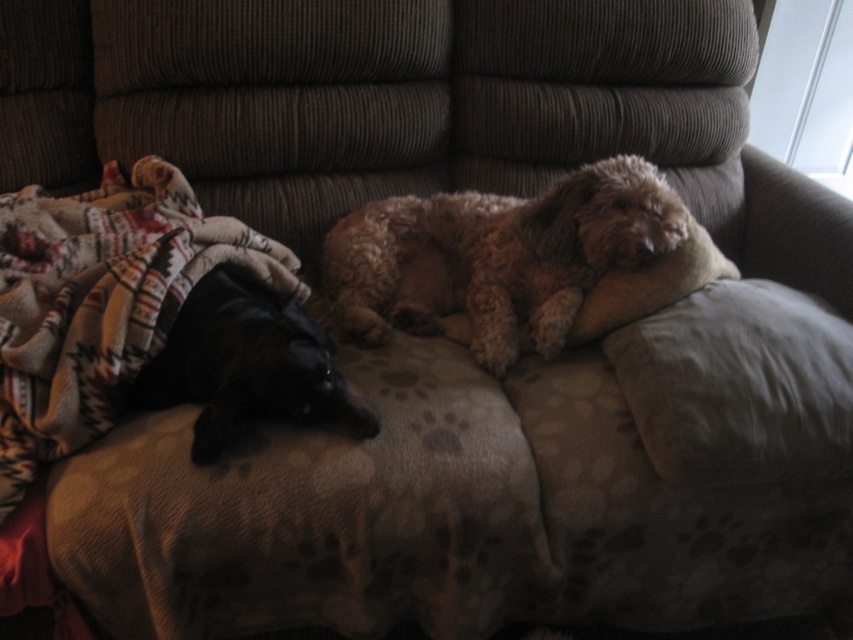
From the picture: Between gray fabric pillow at right and black fur dog at left, which one has less height?

Standing shorter between the two is black fur dog at left.

You are a GUI agent. You are given a task and a screenshot of the screen. Output one action in this format:
    pyautogui.click(x=<x>, y=<y>)
    Task: Click on the gray fabric pillow at right
    This screenshot has width=853, height=640.
    Given the screenshot: What is the action you would take?
    pyautogui.click(x=740, y=385)

Does point (775, 310) come farther from viewer compared to point (294, 394)?

Yes, point (775, 310) is behind point (294, 394).

Locate an element on the screen. This screenshot has width=853, height=640. gray fabric pillow at right is located at coordinates (740, 385).

Is plaid fleece blanket at left smaller than gray fabric pillow at right?

No.

Is point (132, 328) more distant than point (775, 314)?

No, (132, 328) is closer to viewer.

You are a GUI agent. You are given a task and a screenshot of the screen. Output one action in this format:
    pyautogui.click(x=<x>, y=<y>)
    Task: Click on the plaid fleece blanket at left
    
    Given the screenshot: What is the action you would take?
    pyautogui.click(x=99, y=301)

Can you confirm if fuzzy brown dog at center is positioned to the left of black fur dog at left?

Incorrect, fuzzy brown dog at center is not on the left side of black fur dog at left.

Is fuzzy brown dog at center smaller than black fur dog at left?

No, fuzzy brown dog at center is not smaller than black fur dog at left.

Which is behind, point (579, 200) or point (170, 356)?

The point (579, 200) is more distant.

Where is `fuzzy brown dog at center`? fuzzy brown dog at center is located at coordinates (497, 257).